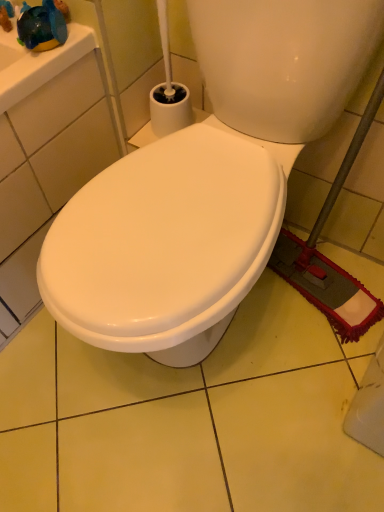
What do you see at coordinates (206, 182) in the screenshot? This screenshot has height=512, width=384. I see `white glossy toilet at center` at bounding box center [206, 182].

Identify the location of white glossy toilet at center. (206, 182).

Image resolution: width=384 pixels, height=512 pixels. I want to click on white glossy toilet at center, so click(206, 182).